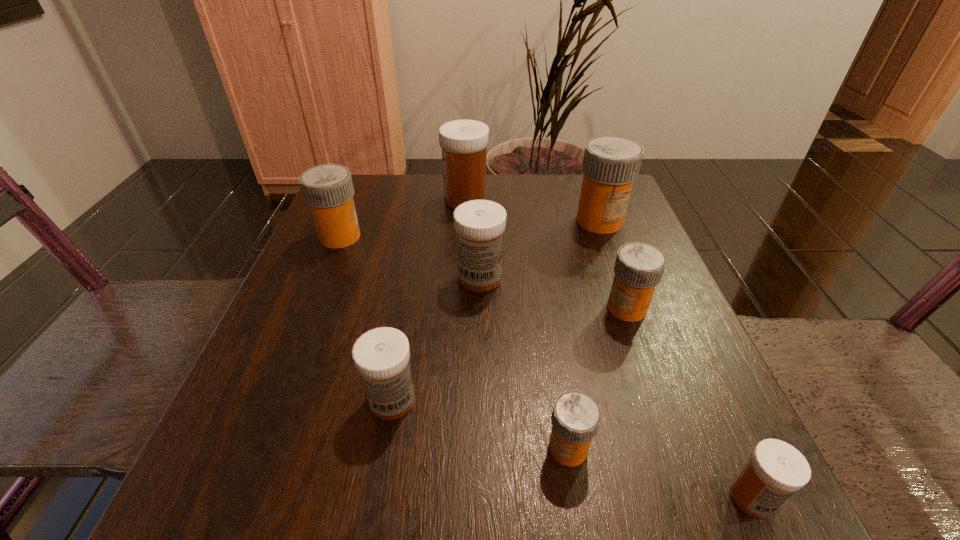
The width and height of the screenshot is (960, 540). I want to click on the fourth closest white medicine relative to the second smallest orange medicine, so click(x=464, y=142).

You are a GUI agent. You are given a task and a screenshot of the screen. Output one action in this format:
    pyautogui.click(x=<x>, y=<y>)
    Task: Click on the vacant space that satisfies the following two spatial constraints: 1. on the label side of the second smallest orange medicine; 2. on the right side of the nearest object
    
    Given the screenshot: What is the action you would take?
    pyautogui.click(x=694, y=497)

Image resolution: width=960 pixels, height=540 pixels. I want to click on vacant region that satisfies the following two spatial constraints: 1. on the label side of the biggest orange medicine; 2. on the label side of the second biggest orange medicine, so click(605, 237).

Locate an element on the screen. free space that satisfies the following two spatial constraints: 1. on the label side of the biggest orange medicine; 2. on the label side of the second smallest orange medicine is located at coordinates (631, 308).

The width and height of the screenshot is (960, 540). In order to click on vacant region that satisfies the following two spatial constraints: 1. on the label side of the nearest object; 2. on the right side of the biggest orange medicine in this screenshot , I will do `click(700, 497)`.

Where is `free space that satisfies the following two spatial constraints: 1. on the label side of the leftmost object; 2. on the back side of the second medicine from left to right`? This screenshot has height=540, width=960. free space that satisfies the following two spatial constraints: 1. on the label side of the leftmost object; 2. on the back side of the second medicine from left to right is located at coordinates (274, 400).

You are a GUI agent. You are given a task and a screenshot of the screen. Output one action in this format:
    pyautogui.click(x=<x>, y=<y>)
    Task: Click on the free space that satisfies the following two spatial constraints: 1. on the label side of the biggest orange medicine; 2. on the label side of the second orange medicine from left to right
    The height and width of the screenshot is (540, 960).
    Given the screenshot: What is the action you would take?
    (682, 448)

The height and width of the screenshot is (540, 960). In order to click on vacant position in the image that satisfies the following two spatial constraints: 1. on the label side of the biggest orange medicine; 2. on the label side of the second nearest orange medicine in this screenshot , I will do `click(631, 308)`.

Find the location of `vacant space that satisfies the following two spatial constraints: 1. on the label side of the nearest object; 2. on the left side of the leftmost object`. vacant space that satisfies the following two spatial constraints: 1. on the label side of the nearest object; 2. on the left side of the leftmost object is located at coordinates (234, 497).

Where is `vacant space that satisfies the following two spatial constraints: 1. on the label side of the seventh farthest medicine; 2. on the left side of the smallest white medicine`? vacant space that satisfies the following two spatial constraints: 1. on the label side of the seventh farthest medicine; 2. on the left side of the smallest white medicine is located at coordinates (576, 497).